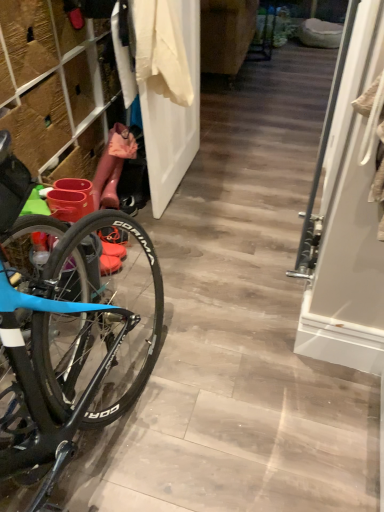
Question: Would you say white matte door at center contains white cotton shirt at upper center?

Choices:
 (A) no
 (B) yes

Answer: (A)

Question: Is white matte door at center closer to camera compared to white cotton shirt at upper center?

Choices:
 (A) no
 (B) yes

Answer: (A)

Question: Does white matte door at center appear on the left side of white cotton shirt at upper center?

Choices:
 (A) yes
 (B) no

Answer: (A)

Question: Can you confirm if white matte door at center is bigger than white cotton shirt at upper center?

Choices:
 (A) no
 (B) yes

Answer: (B)

Question: From the image's perspective, does white matte door at center appear lower than white cotton shirt at upper center?

Choices:
 (A) yes
 (B) no

Answer: (B)

Question: From a real-world perspective, is white matte door at center physically located above or below white cotton shirt at upper center?

Choices:
 (A) above
 (B) below

Answer: (B)

Question: Considering the positions of point (147, 159) and point (155, 36), is point (147, 159) closer or farther from the camera than point (155, 36)?

Choices:
 (A) closer
 (B) farther

Answer: (B)

Question: In terms of width, does white matte door at center look wider or thinner when compared to white cotton shirt at upper center?

Choices:
 (A) wide
 (B) thin

Answer: (B)

Question: Visually, is white matte door at center positioned to the left or to the right of white cotton shirt at upper center?

Choices:
 (A) left
 (B) right

Answer: (A)

Question: Considering the positions of rubber boots at left and white matte door at center in the image, is rubber boots at left wider or thinner than white matte door at center?

Choices:
 (A) thin
 (B) wide

Answer: (B)

Question: Would you say rubber boots at left is to the left or to the right of white matte door at center in the picture?

Choices:
 (A) left
 (B) right

Answer: (A)

Question: Considering their positions, is rubber boots at left located in front of or behind white matte door at center?

Choices:
 (A) behind
 (B) front

Answer: (B)

Question: Which is correct: rubber boots at left is inside white matte door at center, or outside of it?

Choices:
 (A) outside
 (B) inside

Answer: (A)

Question: Considering their positions, is white cotton shirt at upper center located in front of or behind white glossy screen door at right?

Choices:
 (A) behind
 (B) front

Answer: (A)

Question: Which is correct: white cotton shirt at upper center is inside white glossy screen door at right, or outside of it?

Choices:
 (A) outside
 (B) inside

Answer: (A)